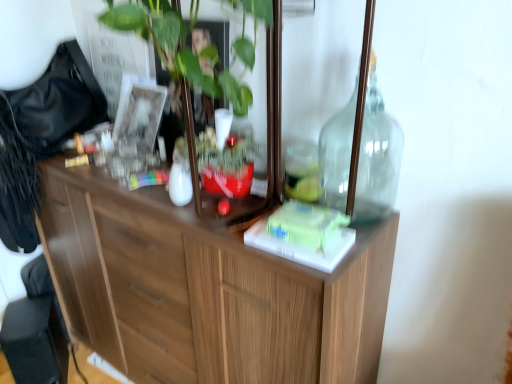
Question: Relative to black plastic swivel chair at lower left, is wooden cabinet at center in front or behind?

Choices:
 (A) behind
 (B) front

Answer: (B)

Question: Is wooden cabinet at center to the left or to the right of black plastic swivel chair at lower left in the image?

Choices:
 (A) left
 (B) right

Answer: (B)

Question: Which object is positioned closest to the wooden cabinet at center?

Choices:
 (A) transparent glass bottle at upper right
 (B) black plastic swivel chair at lower left

Answer: (A)

Question: Estimate the real-world distances between objects in this image. Which object is farther from the transparent glass bottle at upper right?

Choices:
 (A) black plastic swivel chair at lower left
 (B) wooden cabinet at center

Answer: (A)